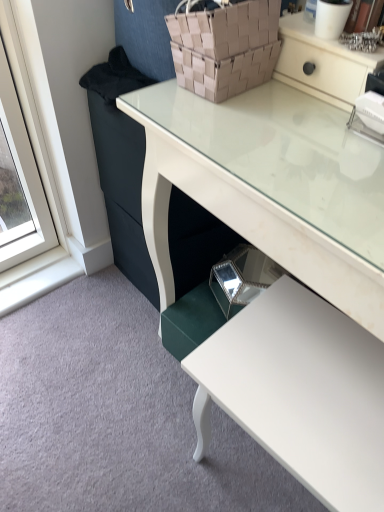
Identify the location of vacant area that is situated to the right of brown woven basket at upper center. This screenshot has height=512, width=384. (290, 100).